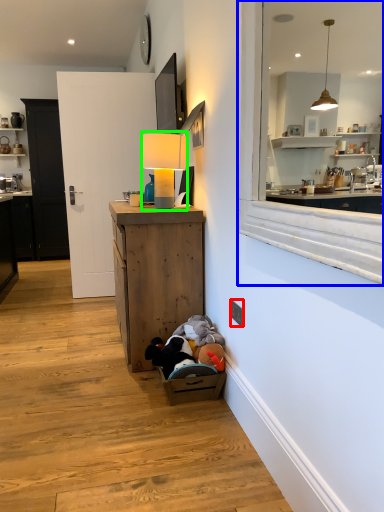
Question: Which object is the farthest from electric outlet (highlighted by a red box)? Choose among these: window (highlighted by a blue box) or table lamp (highlighted by a green box).

Choices:
 (A) window
 (B) table lamp

Answer: (B)